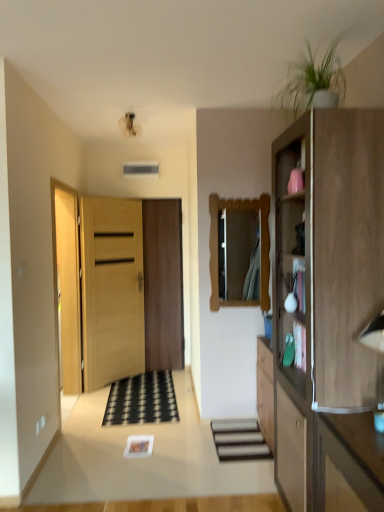
Question: Is light brown wood cabinet at right taller or shorter than wooden door at center, the second door from the front?

Choices:
 (A) tall
 (B) short

Answer: (A)

Question: From the image's perspective, is light brown wood cabinet at right positioned above or below wooden door at center, placed as the 1th door when sorted from back to front?

Choices:
 (A) above
 (B) below

Answer: (B)

Question: Which object is the closest to the wooden mirror at center?

Choices:
 (A) black rubber doormat at center
 (B) wooden door at center, acting as the 1th door starting from the front
 (C) wooden door at center, placed as the 1th door when sorted from back to front
 (D) smooth wooden stairs at center
 (E) light brown wood cabinet at right

Answer: (D)

Question: Which object is positioned farthest from the smooth wooden stairs at center?

Choices:
 (A) green matte plant at upper right
 (B) wooden mirror at center
 (C) wooden door at center, acting as the 1th door starting from the front
 (D) wooden door at center, placed as the 1th door when sorted from back to front
 (E) light brown wood cabinet at right

Answer: (A)